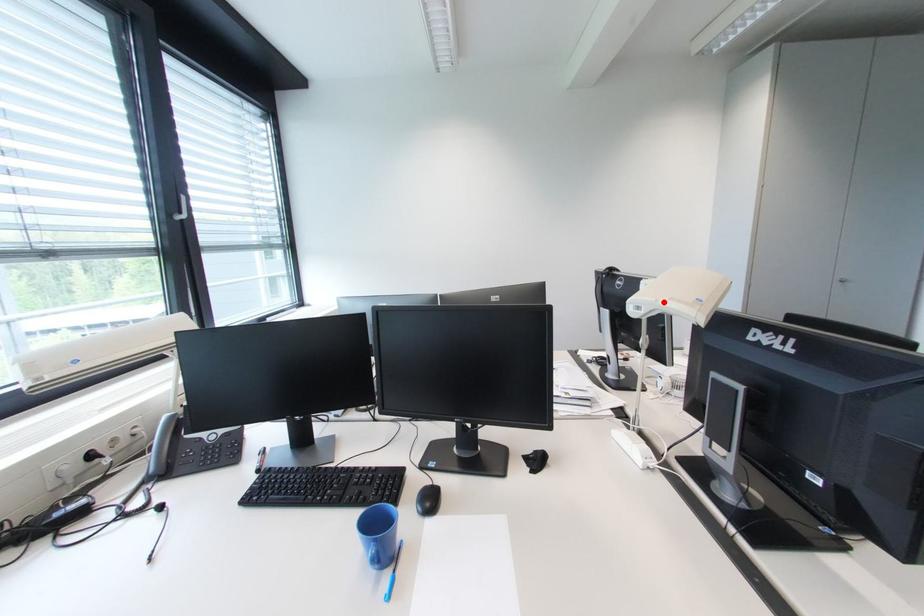
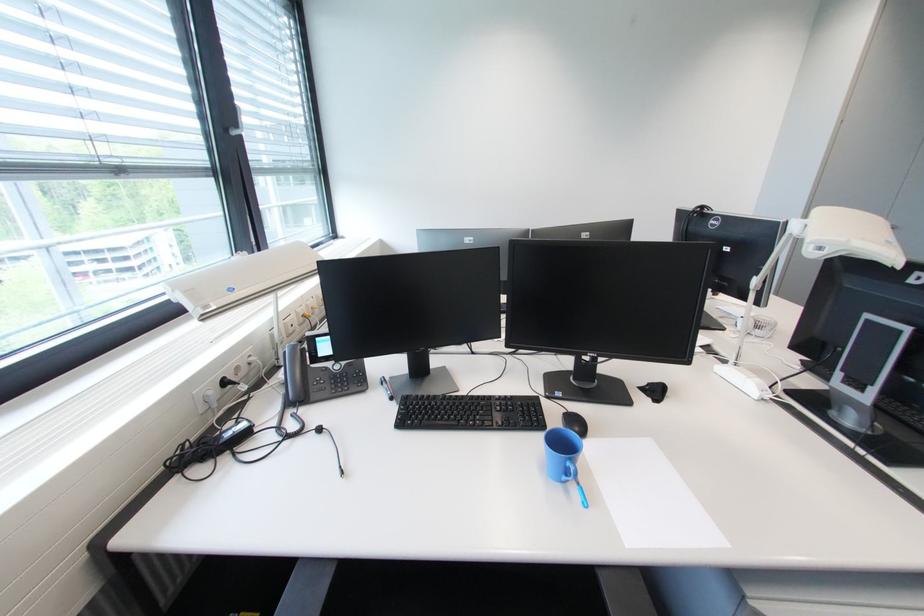
Where in the second image is the point corresponding to the highlighted location from the first image?

(856, 243)